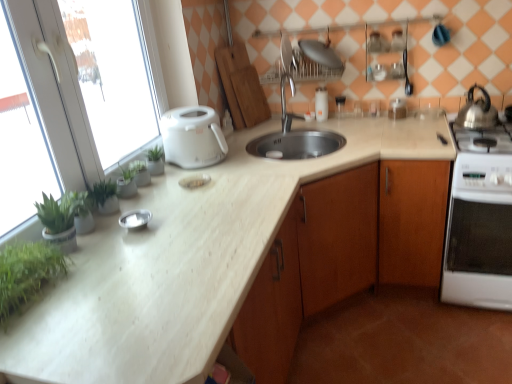
Locate an element on the screen. This screenshot has width=512, height=384. free point in front of green leafy plant at left is located at coordinates (139, 273).